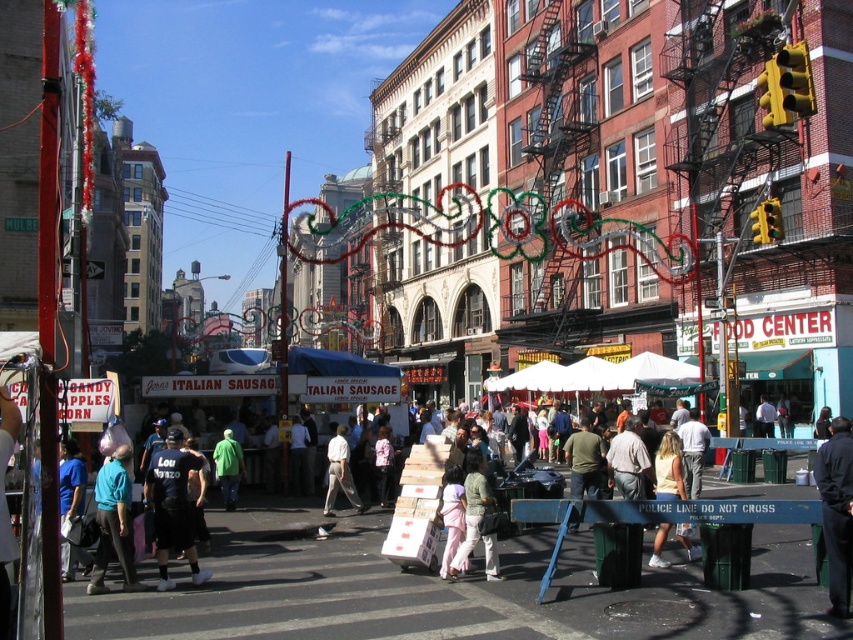
Who is taller, dark blue fabric at center or pink silk saree at center?

Standing taller between the two is dark blue fabric at center.

Does dark blue fabric at center have a smaller size compared to pink silk saree at center?

No, dark blue fabric at center is not smaller than pink silk saree at center.

Between point (831, 518) and point (456, 540), which one is positioned behind?

Positioned behind is point (456, 540).

This screenshot has height=640, width=853. What are the coordinates of `dark blue fabric at center` in the screenshot? It's located at (836, 512).

Can you confirm if pink silk saree at center is thinner than white cotton shirt at center?

No.

The width and height of the screenshot is (853, 640). In order to click on pink silk saree at center in this screenshot , I will do `click(451, 513)`.

Based on the photo, who is more distant from viewer, (x=93, y=566) or (x=451, y=488)?

Positioned behind is point (x=451, y=488).

What do you see at coordinates (114, 522) in the screenshot?
I see `teal fabric shirt at center` at bounding box center [114, 522].

Image resolution: width=853 pixels, height=640 pixels. Describe the element at coordinates (114, 522) in the screenshot. I see `teal fabric shirt at center` at that location.

The height and width of the screenshot is (640, 853). I want to click on teal fabric shirt at center, so click(x=114, y=522).